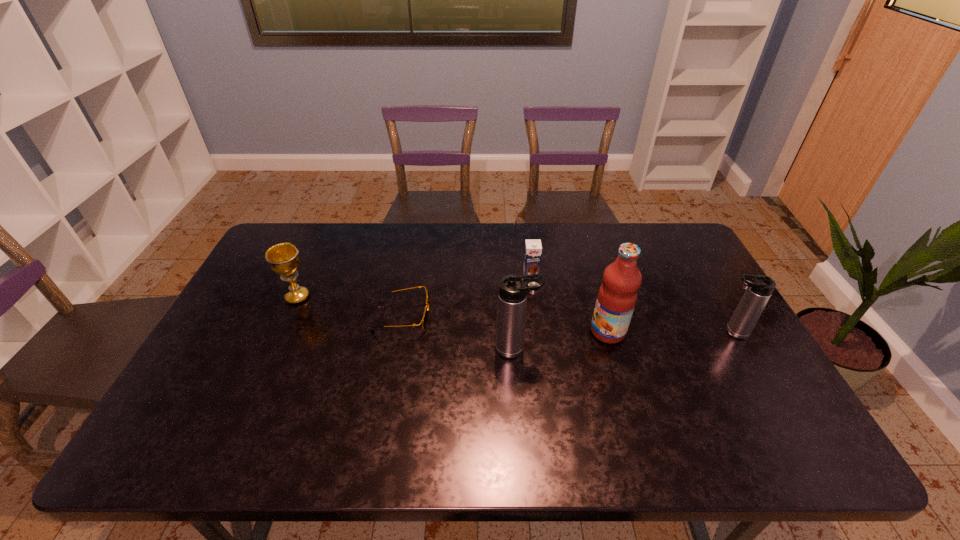
In the current image, all thermos bottles are evenly spaced. To maintain this equal spacing, where should an additional thermos bottle be placed on the left? Please point out a free spot. Please provide its 2D coordinates. Your answer should be formatted as a tuple, i.e. [(x, y)], where the tuple contains the x and y coordinates of a point satisfying the conditions above.

[(282, 367)]